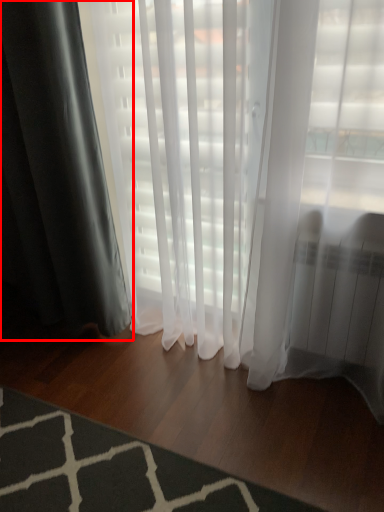
Question: From the image's perspective, considering the relative positions of curtain (annotated by the red box) and mat in the image provided, where is curtain (annotated by the red box) located with respect to the staircase?

Choices:
 (A) above
 (B) below

Answer: (A)